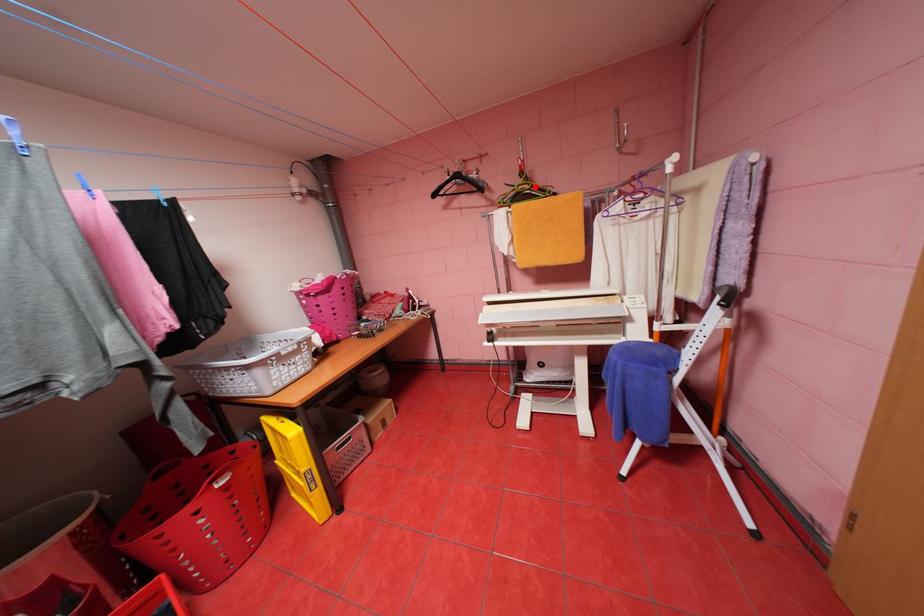
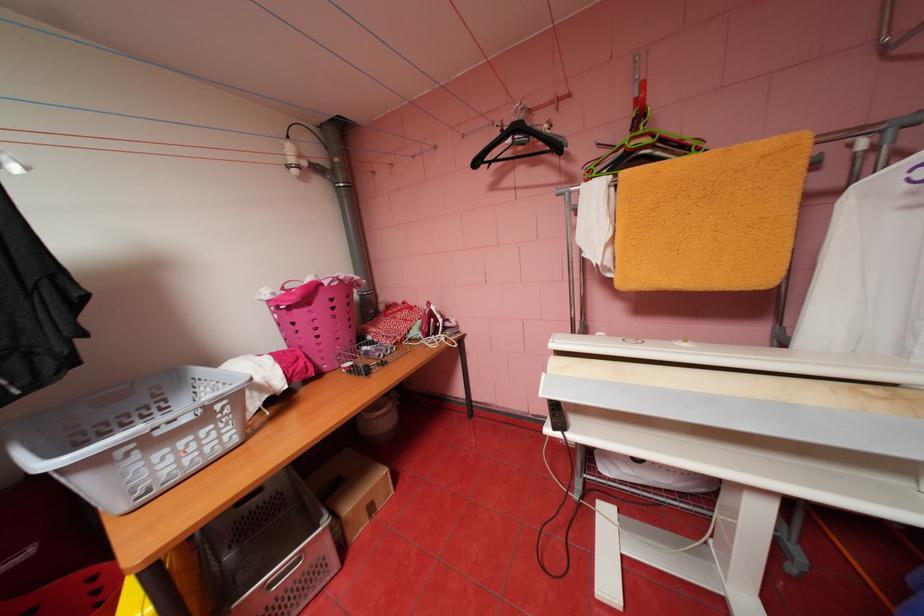
In the second image, find the point that corresponds to the highlighted location in the first image.

(655, 140)